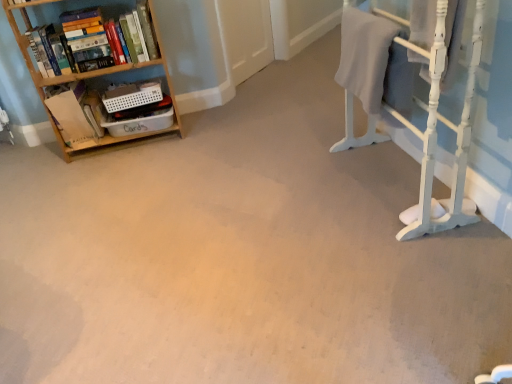
Where is `vacant area that lies between wooden bookshelf at left and white painted wood bunk bed at right`? This screenshot has width=512, height=384. vacant area that lies between wooden bookshelf at left and white painted wood bunk bed at right is located at coordinates (240, 167).